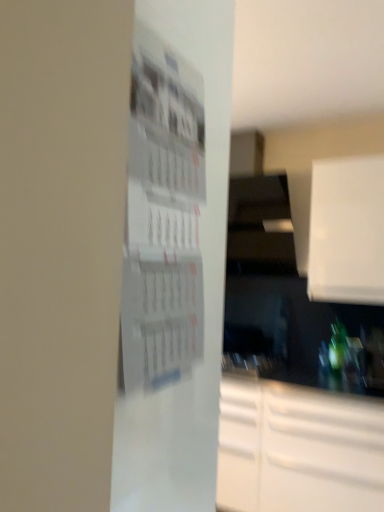
Question: Based on their sizes in the image, would you say green glass bottle at lower right is bigger or smaller than white matte cabinet at upper right?

Choices:
 (A) small
 (B) big

Answer: (A)

Question: Is green glass bottle at lower right taller or shorter than white matte cabinet at upper right?

Choices:
 (A) short
 (B) tall

Answer: (A)

Question: Based on their relative distances, which object is nearer to the white matte cabinet at upper right?

Choices:
 (A) white paper at center
 (B) green glass bottle at lower right

Answer: (B)

Question: Considering the real-world distances, which object is farthest from the white paper at center?

Choices:
 (A) green glass bottle at lower right
 (B) white matte cabinet at upper right

Answer: (A)